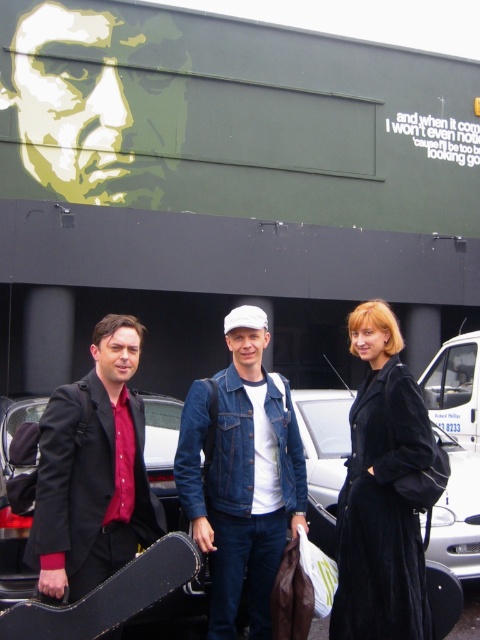
You are standing in front of the building and want to hand a document to the person wearing the denim jacket at center. Which direction should you walk to reach them?

The denim jacket at center is located at point 0.742 on the x axis and 0.504 on the y axis, so you should walk towards the center of the image to reach them.

You are standing in front of the building and want to find the denim jacket at center. Where should you look?

The denim jacket at center is located at point (241, 474).

You are a fashion designer observing the jackets in the scene. Which jacket is taller, the denim jacket at center or the matte black jacket at left?

The denim jacket at center is taller than the matte black jacket at left.